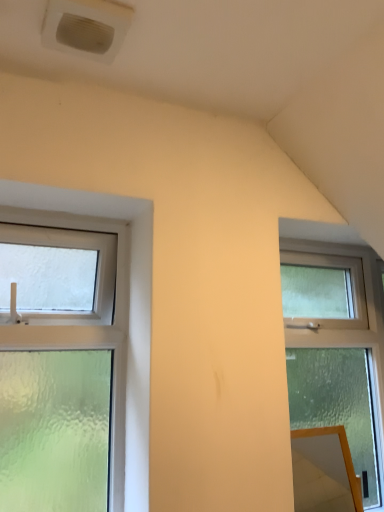
Question: In terms of width, does orange glossy mirror at lower right look wider or thinner when compared to clear frosted glass window at right, the 2th window from the left?

Choices:
 (A) thin
 (B) wide

Answer: (A)

Question: From the image's perspective, is orange glossy mirror at lower right above or below clear frosted glass window at right, the 2th window from the left?

Choices:
 (A) above
 (B) below

Answer: (B)

Question: Estimate the real-world distances between objects in this image. Which object is farther from the clear glass window at left, the 1th window viewed from the left?

Choices:
 (A) clear frosted glass window at right, the first window viewed from the right
 (B) white plastic air conditioning unit at upper left
 (C) orange glossy mirror at lower right

Answer: (A)

Question: Which is farther from the clear frosted glass window at right, the first window viewed from the right?

Choices:
 (A) orange glossy mirror at lower right
 (B) clear glass window at left, the 1th window viewed from the left
 (C) white plastic air conditioning unit at upper left

Answer: (C)